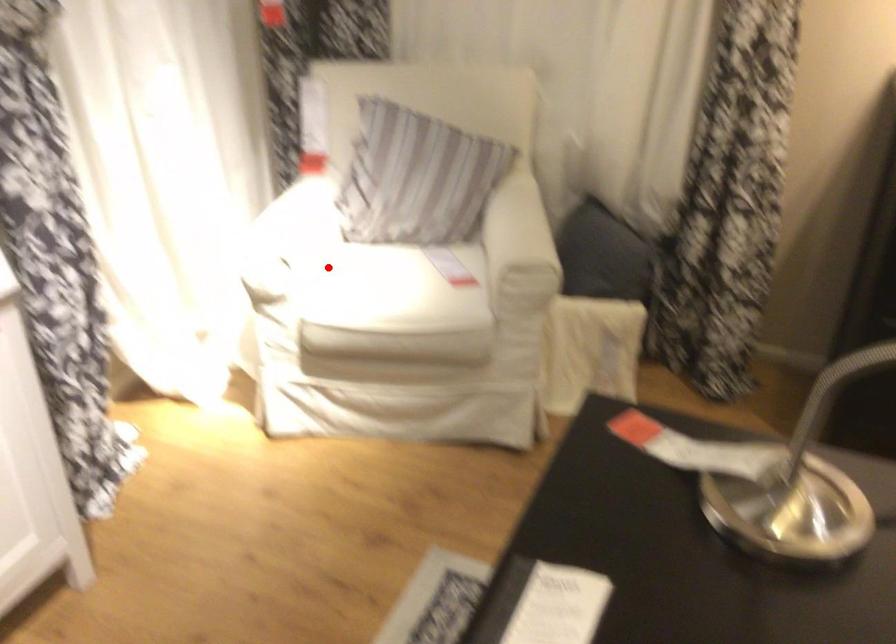
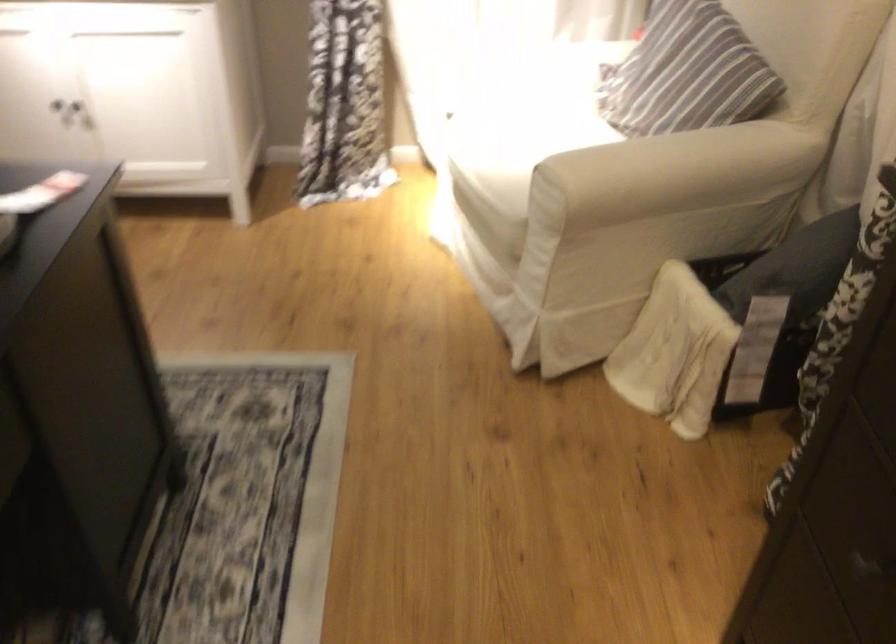
Question: I am providing you with two images of the same scene from different viewpoints. A red point is marked on the first image. Can you still see the location of the red point in image 2?

Choices:
 (A) Yes
 (B) No

Answer: (A)